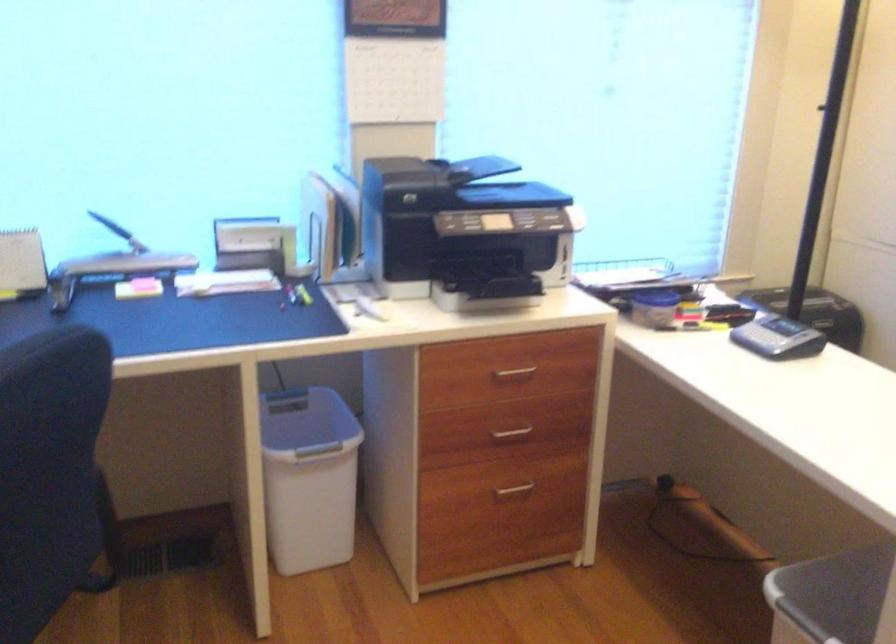
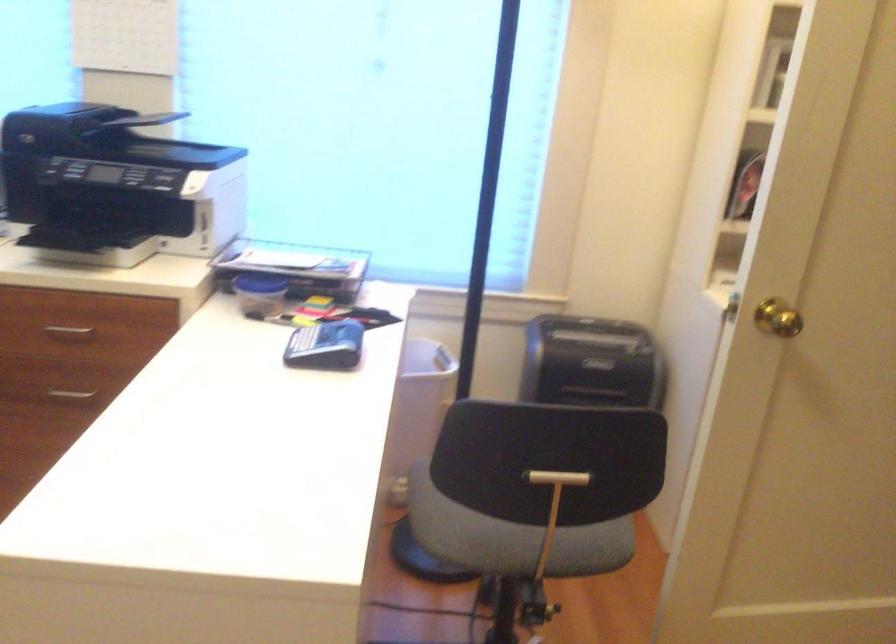
Question: I am providing you with two images of the same scene from different viewpoints. Which of the following objects are not visible in image2?

Choices:
 (A) black paper shredder
 (B) gold door handle
 (C) black power socket
 (D) drawer handle

Answer: (D)